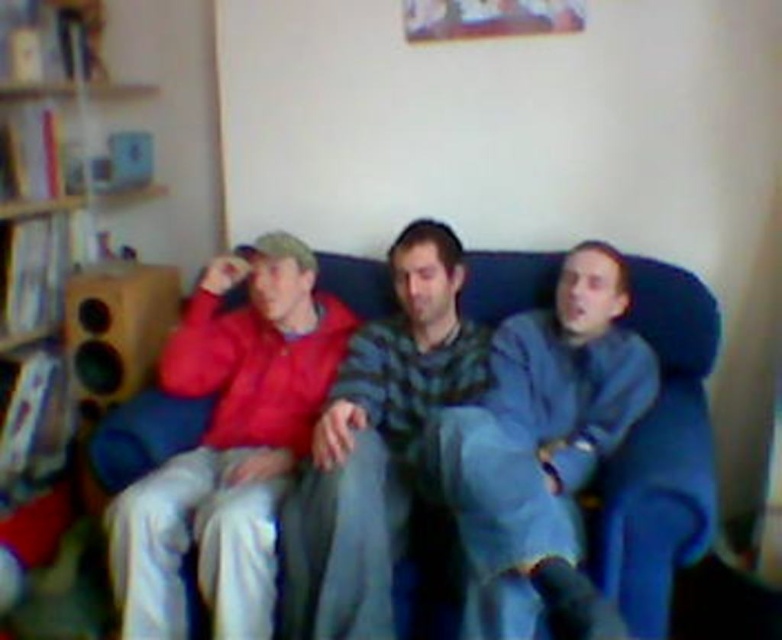
Question: Which object is the farthest from the striped sweater at center?

Choices:
 (A) blue fuzzy blanket at center
 (B) wooden bookshelf at left
 (C) blue fabric couch at center

Answer: (B)

Question: Is wooden bookshelf at left in front of striped sweater at center?

Choices:
 (A) no
 (B) yes

Answer: (A)

Question: Is wooden bookshelf at left positioned in front of striped sweater at center?

Choices:
 (A) no
 (B) yes

Answer: (A)

Question: Which object is farther from the camera taking this photo?

Choices:
 (A) wooden bookshelf at left
 (B) blue fuzzy blanket at center
 (C) matte red jacket at left

Answer: (A)

Question: Can you confirm if wooden bookshelf at left is positioned to the left of striped sweater at center?

Choices:
 (A) yes
 (B) no

Answer: (A)

Question: Which of the following is the farthest from the observer?

Choices:
 (A) (x=549, y=323)
 (B) (x=117, y=140)

Answer: (B)